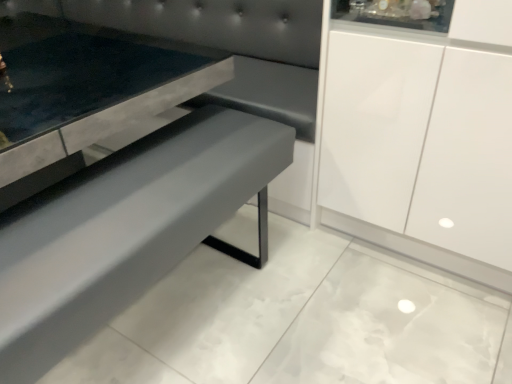
The width and height of the screenshot is (512, 384). What do you see at coordinates (225, 45) in the screenshot? I see `suede-like gray couch at center` at bounding box center [225, 45].

Locate an element on the screen. suede-like gray couch at center is located at coordinates (225, 45).

Describe the element at coordinates (123, 229) in the screenshot. I see `matte gray bench at center` at that location.

The height and width of the screenshot is (384, 512). In order to click on matte gray bench at center in this screenshot , I will do `click(123, 229)`.

The width and height of the screenshot is (512, 384). Identify the location of suede-like gray couch at center. (225, 45).

Can you confirm if suede-like gray couch at center is positioned to the left of matte gray bench at center?

Yes, suede-like gray couch at center is to the left of matte gray bench at center.

Considering the relative positions of suede-like gray couch at center and matte gray bench at center in the image provided, is suede-like gray couch at center in front of matte gray bench at center?

No.

Does point (106, 4) lie in front of point (189, 143)?

That is False.

From the image's perspective, which is below, suede-like gray couch at center or matte gray bench at center?

matte gray bench at center, from the image's perspective.

Consider the image. From a real-world perspective, is suede-like gray couch at center over matte gray bench at center?

Yes, from a real-world perspective, suede-like gray couch at center is on top of matte gray bench at center.

Does suede-like gray couch at center have a greater width compared to matte gray bench at center?

Yes, suede-like gray couch at center is wider than matte gray bench at center.

Between suede-like gray couch at center and matte gray bench at center, which one has less height?

With less height is matte gray bench at center.

From the picture: Considering the sizes of objects suede-like gray couch at center and matte gray bench at center in the image provided, who is bigger, suede-like gray couch at center or matte gray bench at center?

With larger size is suede-like gray couch at center.

Would you say suede-like gray couch at center is inside or outside matte gray bench at center?

suede-like gray couch at center is spatially situated outside matte gray bench at center.

Is suede-like gray couch at center directly adjacent to matte gray bench at center?

They are not placed beside each other.

Is suede-like gray couch at center looking in the opposite direction of matte gray bench at center?

That's not correct — suede-like gray couch at center is not looking away from matte gray bench at center.

How different are the orientations of suede-like gray couch at center and matte gray bench at center in degrees?

suede-like gray couch at center and matte gray bench at center are facing 92.6 degrees away from each other.

Based on the photo, measure the distance from suede-like gray couch at center to matte gray bench at center.

suede-like gray couch at center is 65.46 centimeters from matte gray bench at center.

Locate an element on the screen. This screenshot has width=512, height=384. couch above the matte gray bench at center (from a real-world perspective) is located at coordinates (225, 45).

Can you confirm if matte gray bench at center is positioned to the left of suede-like gray couch at center?

No.

Is matte gray bench at center further to the viewer compared to suede-like gray couch at center?

That is False.

From the picture: Which point is more distant from viewer, (110, 297) or (240, 93)?

The point (240, 93) is farther from the camera.

From the image's perspective, is matte gray bench at center on suede-like gray couch at center?

Actually, matte gray bench at center appears below suede-like gray couch at center in the image.

In the scene shown: From a real-world perspective, which object rests below the other?

matte gray bench at center, from a real-world perspective.

Which object is wider, matte gray bench at center or suede-like gray couch at center?

suede-like gray couch at center.

In terms of height, does matte gray bench at center look taller or shorter compared to suede-like gray couch at center?

matte gray bench at center is shorter than suede-like gray couch at center.

Between matte gray bench at center and suede-like gray couch at center, which one has smaller size?

Smaller between the two is matte gray bench at center.

Is matte gray bench at center positioned beyond the bounds of suede-like gray couch at center?

matte gray bench at center lies outside suede-like gray couch at center's area.

Does matte gray bench at center touch suede-like gray couch at center?

No.

Is matte gray bench at center oriented away from suede-like gray couch at center?

No.

Looking at this image, how different are the orientations of matte gray bench at center and suede-like gray couch at center in degrees?

92.6 degrees separate the facing orientations of matte gray bench at center and suede-like gray couch at center.

How much distance is there between matte gray bench at center and suede-like gray couch at center?

A distance of 25.77 inches exists between matte gray bench at center and suede-like gray couch at center.

Find the location of a particular element. This screenshot has width=512, height=384. park bench below the suede-like gray couch at center (from the image's perspective) is located at coordinates (123, 229).

You are a GUI agent. You are given a task and a screenshot of the screen. Output one action in this format:
    pyautogui.click(x=<x>, y=<y>)
    Task: Click on the park bench lying below the suede-like gray couch at center (from the image's perspective)
    
    Given the screenshot: What is the action you would take?
    pyautogui.click(x=123, y=229)

In order to click on couch to the left of matte gray bench at center in this screenshot , I will do `click(225, 45)`.